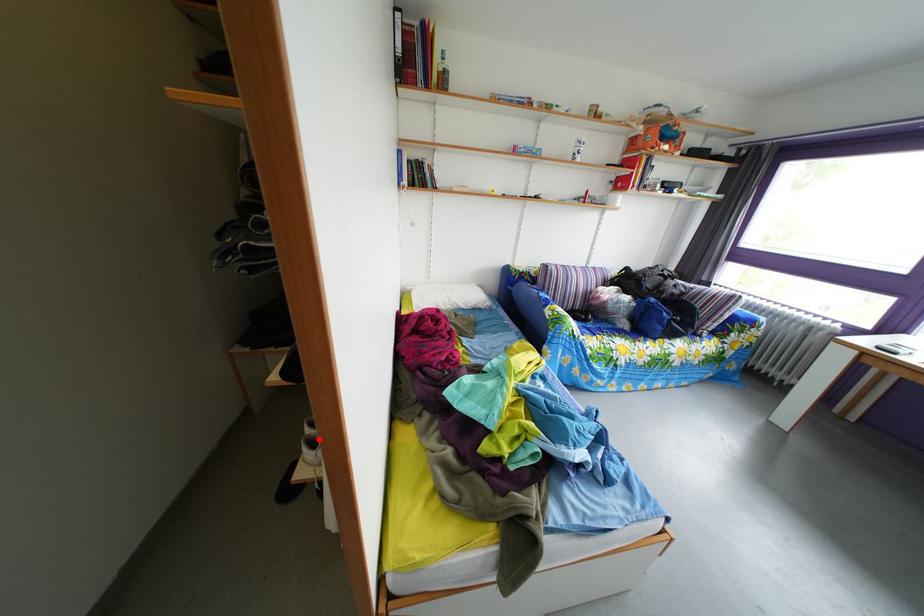
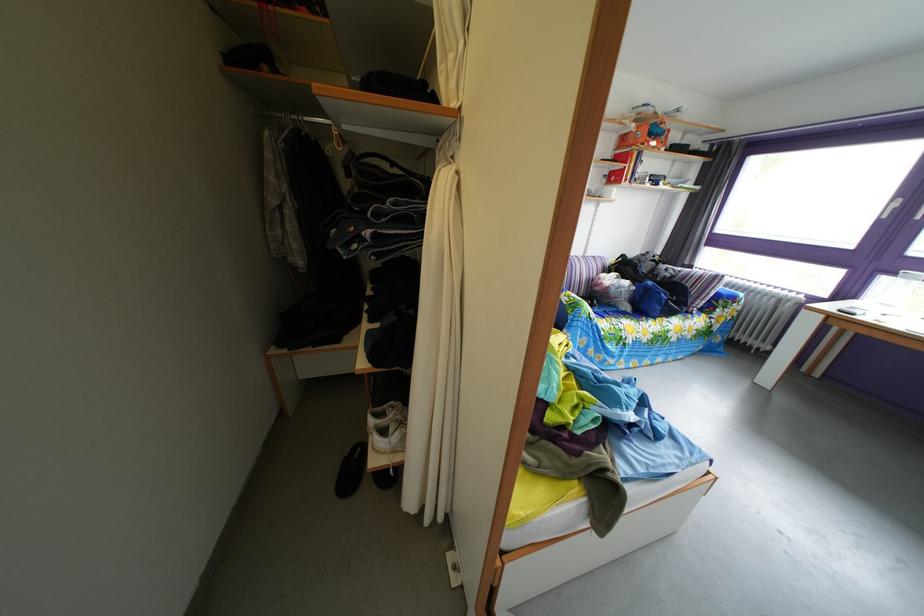
Find the pixel in the second image that matches the highlighted location in the first image.

(383, 430)